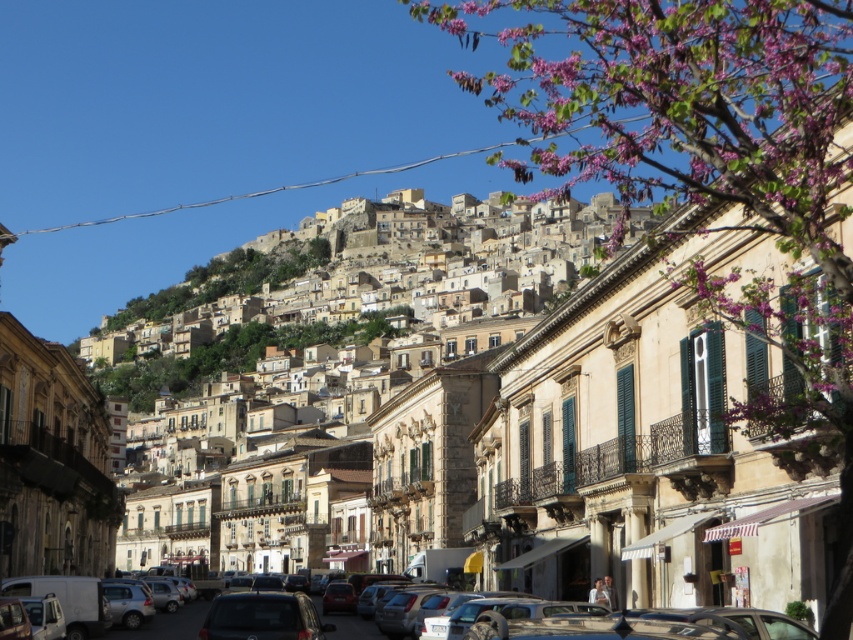
You are standing on the street in the historic town and want to walk from the point at coordinates point (x=386, y=227) to the point at coordinates point (x=762, y=634). Which direction should you face to move towards the second point?

You should face towards the lower right direction because point (x=762, y=634) is further away from the viewer compared to point (x=386, y=227).

You are standing at the point labeled as point (413, 339) in the image. Looking around, what architectural feature do you see immediately around you?

The point (413, 339) indicates beige stone buildings at center, so you are surrounded by beige stone buildings at center with their classical European architectural details like columns and wrought iron balconies.